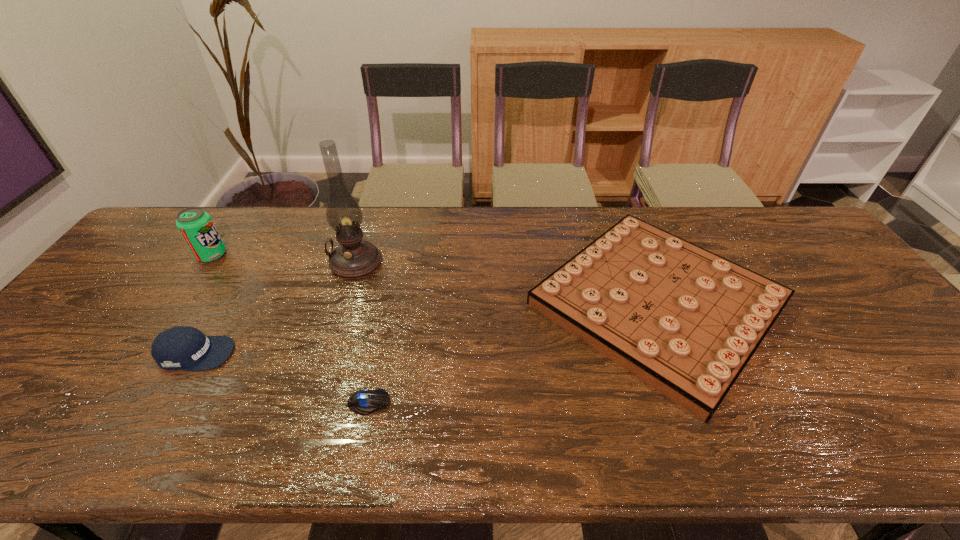
Find the location of a particular element. This screenshot has height=540, width=960. the third object from left to right is located at coordinates [353, 258].

Locate an element on the screen. This screenshot has width=960, height=540. oil lamp is located at coordinates (353, 258).

Identify the location of the second tallest object. The height and width of the screenshot is (540, 960). (195, 225).

The height and width of the screenshot is (540, 960). Identify the location of baseball cap. (186, 348).

This screenshot has width=960, height=540. Identify the location of the fourth tallest object. (686, 321).

You are a GUI agent. You are given a task and a screenshot of the screen. Output one action in this format:
    pyautogui.click(x=<x>, y=<y>)
    Task: Click on the gameboard
    Image resolution: width=960 pixels, height=540 pixels.
    Given the screenshot: What is the action you would take?
    pyautogui.click(x=686, y=321)

You are a GUI agent. You are given a task and a screenshot of the screen. Output one action in this format:
    pyautogui.click(x=<x>, y=<y>)
    Task: Click on the second object from right to left
    This screenshot has width=960, height=540.
    Given the screenshot: What is the action you would take?
    (x=365, y=402)

Where is `computer mouse`? The height and width of the screenshot is (540, 960). computer mouse is located at coordinates (365, 402).

I want to click on vacant space situated 0.080m on the left of the third object from right to left, so click(x=302, y=262).

Where is `vacant region located on the front-facing side of the pop soda`? The height and width of the screenshot is (540, 960). vacant region located on the front-facing side of the pop soda is located at coordinates [x=246, y=255].